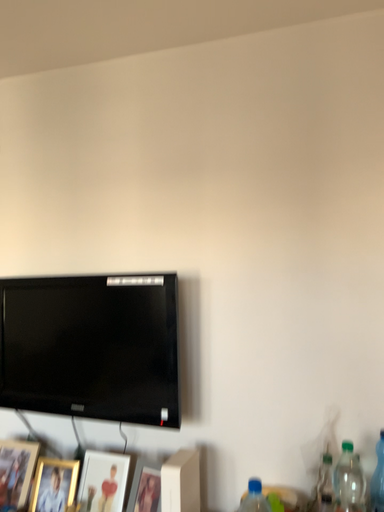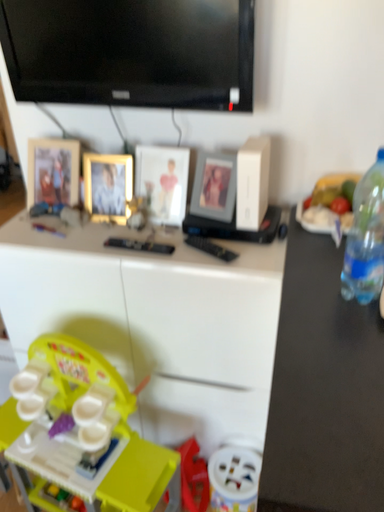
Question: How did the camera likely rotate when shooting the video?

Choices:
 (A) rotated downward
 (B) rotated upward

Answer: (A)